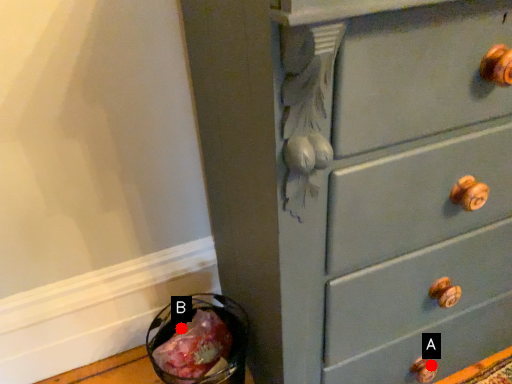
Question: Two points are circled on the image, labeled by A and B beside each circle. Which of the following is the farthest from the observer?

Choices:
 (A) A is further
 (B) B is further

Answer: (A)